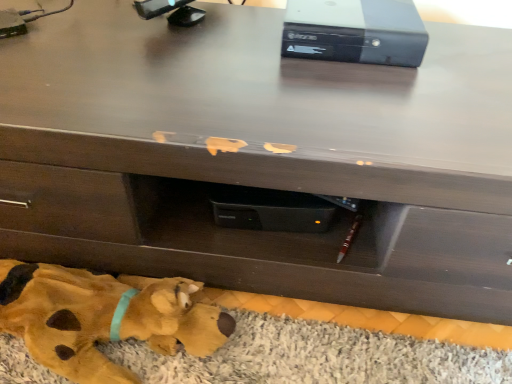
What is the approximate width of black plastic computer at upper center?

It is 10.71 inches.

Image resolution: width=512 pixels, height=384 pixels. Find the location of `black plastic computer at upper center`. black plastic computer at upper center is located at coordinates (355, 31).

Which is closer, (323, 59) or (26, 361)?

Point (323, 59) is positioned farther from the camera compared to point (26, 361).

Can you confirm if black plastic computer at upper center is thinner than yellow fabric mat at lower left?

Yes.

This screenshot has height=384, width=512. In order to click on mat that is in front of the black plastic computer at upper center in this screenshot , I will do `click(315, 357)`.

Between yellow fabric mat at lower left and black plastic computer at upper center, which one appears on the right side from the viewer's perspective?

From the viewer's perspective, black plastic computer at upper center appears more on the right side.

In the image, there is a black plastic computer at upper center. Where is `mat below it (from the image's perspective)`? mat below it (from the image's perspective) is located at coordinates (315, 357).

Is yellow fabric mat at lower left spatially inside black plastic computer at upper center, or outside of it?

yellow fabric mat at lower left is not enclosed by black plastic computer at upper center.

Considering the relative sizes of yellow fabric mat at lower left and black plastic computer at upper center in the image provided, is yellow fabric mat at lower left wider than black plastic computer at upper center?

Yes.

Is yellow fabric mat at lower left outside of yellow plush toy at lower left?

That's correct, yellow fabric mat at lower left is outside of yellow plush toy at lower left.

Is yellow fabric mat at lower left touching yellow plush toy at lower left?

No, yellow fabric mat at lower left is not making contact with yellow plush toy at lower left.

Is point (403, 350) in front of point (130, 315)?

No, it is behind (130, 315).

Is yellow fabric mat at lower left bigger than yellow plush toy at lower left?

Actually, yellow fabric mat at lower left might be smaller than yellow plush toy at lower left.

Who is shorter, yellow plush toy at lower left or black plastic computer at upper center?

black plastic computer at upper center.

Is yellow plush toy at lower left inside the boundaries of black plastic computer at upper center, or outside?

yellow plush toy at lower left is not inside black plastic computer at upper center, it's outside.

Which is more to the right, yellow plush toy at lower left or black plastic computer at upper center?

From the viewer's perspective, black plastic computer at upper center appears more on the right side.

Identify the location of toy below the black plastic computer at upper center (from a real-world perspective). The height and width of the screenshot is (384, 512). (103, 318).

Is point (27, 295) farther from camera compared to point (277, 353)?

That is False.

How many degrees apart are the facing directions of yellow plush toy at lower left and yellow fabric mat at lower left?

yellow plush toy at lower left and yellow fabric mat at lower left are facing 88.7 degrees away from each other.

From the image's perspective, is yellow plush toy at lower left above or below yellow fabric mat at lower left?

From the image's perspective, yellow plush toy at lower left appears above yellow fabric mat at lower left.

Considering the sizes of objects black plastic computer at upper center and yellow plush toy at lower left in the image provided, who is wider, black plastic computer at upper center or yellow plush toy at lower left?

With larger width is black plastic computer at upper center.

In the scene shown: Is black plastic computer at upper center outside of yellow plush toy at lower left?

black plastic computer at upper center lies outside yellow plush toy at lower left's area.

Would you consider black plastic computer at upper center to be distant from yellow plush toy at lower left?

No, black plastic computer at upper center is in close proximity to yellow plush toy at lower left.

From the image's perspective, is black plastic computer at upper center located above yellow plush toy at lower left?

Yes.

I want to click on computer to the right of yellow fabric mat at lower left, so click(355, 31).

Identify the location of computer that appears above the yellow fabric mat at lower left (from a real-world perspective). Image resolution: width=512 pixels, height=384 pixels. [x=355, y=31].

Considering their positions, is yellow plush toy at lower left positioned closer to black plastic computer at upper center than yellow fabric mat at lower left?

Based on the image, yellow fabric mat at lower left appears to be nearer to black plastic computer at upper center.

Based on their spatial positions, is yellow fabric mat at lower left or black plastic computer at upper center closer to yellow plush toy at lower left?

yellow fabric mat at lower left lies closer to yellow plush toy at lower left than the other object.

From the image, which object appears to be nearer to yellow plush toy at lower left, black plastic computer at upper center or yellow fabric mat at lower left?

Among the two, yellow fabric mat at lower left is located nearer to yellow plush toy at lower left.

Based on their spatial positions, is black plastic computer at upper center or yellow plush toy at lower left closer to yellow fabric mat at lower left?

Based on the image, yellow plush toy at lower left appears to be nearer to yellow fabric mat at lower left.

Considering their positions, is yellow plush toy at lower left positioned further to yellow fabric mat at lower left than black plastic computer at upper center?

black plastic computer at upper center lies further to yellow fabric mat at lower left than the other object.

Estimate the real-world distances between objects in this image. Which object is closer to black plastic computer at upper center, yellow fabric mat at lower left or yellow plush toy at lower left?

yellow fabric mat at lower left.

The height and width of the screenshot is (384, 512). I want to click on toy between black plastic computer at upper center and yellow fabric mat at lower left vertically, so click(x=103, y=318).